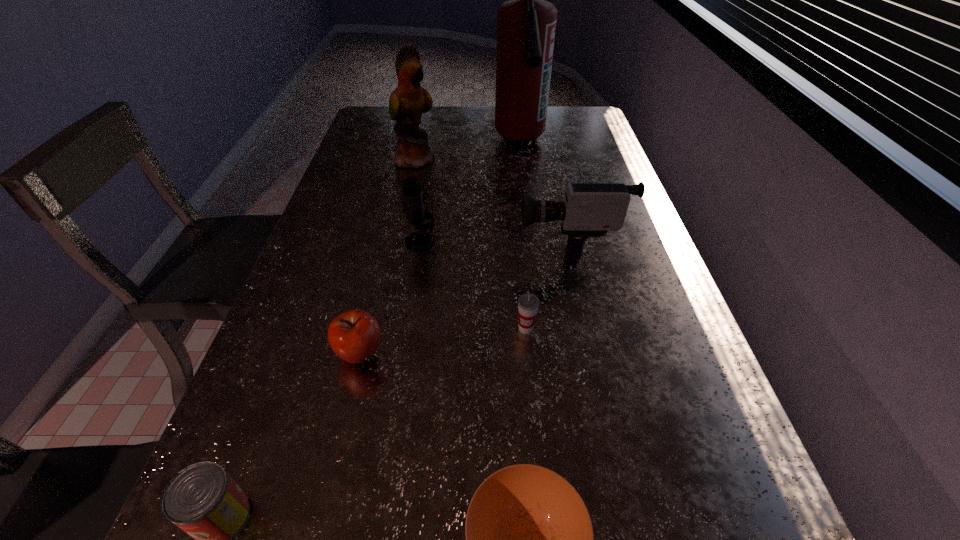
What are the coordinates of `fire extinguisher` in the screenshot? It's located at coord(526,25).

This screenshot has height=540, width=960. I want to click on the seventh shortest object, so click(409, 100).

Find the location of a particular element. camcorder is located at coordinates (589, 210).

I want to click on microphone, so click(x=413, y=196).

Where is `apple`? Image resolution: width=960 pixels, height=540 pixels. apple is located at coordinates (354, 336).

Identify the location of cup. (528, 303).

Identify the location of free location located 0.200m at the nozzle of the fire extinguisher. Image resolution: width=960 pixels, height=540 pixels. (530, 214).

At what (x,y) coordinates should I click in order to perform the action: click on free space located on the front-facing side of the second tallest object. Please return your answer as a coordinate pair (x, y). Looking at the image, I should click on (466, 159).

What are the coordinates of `blank area located on the recording direction of the camcorder` in the screenshot? It's located at (367, 242).

Locate an element on the screen. The image size is (960, 540). free space located 0.160m on the recording direction of the camcorder is located at coordinates (454, 242).